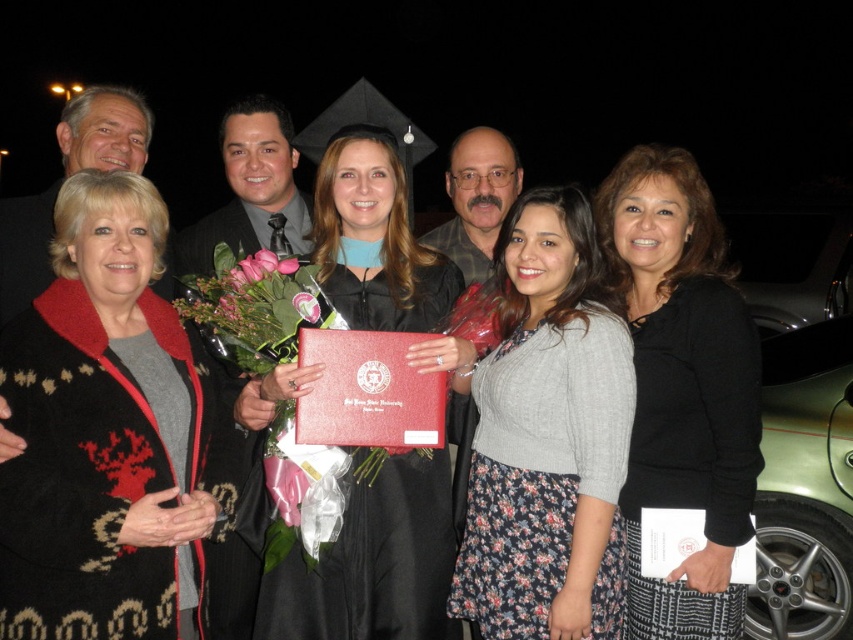
You are a photographer at the event and need to ensure both the floral print dress at center and the black sweater at center are visible in the photo. Which one might require you to adjust your framing to include it fully?

The black sweater at center is larger than the floral print dress at center, so it might require adjusting the framing to ensure it is fully visible in the photo.